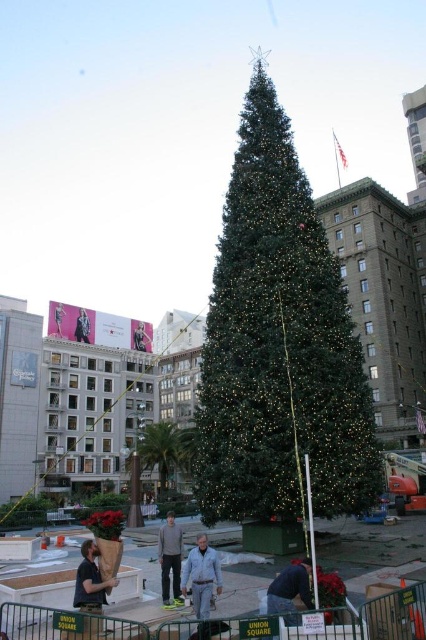
You are standing in front of the Christmas tree in Union Square and see a dark brown leather jacket at lower left. Where exactly is the dark brown leather jacket located in terms of coordinates?

The dark brown leather jacket at lower left is located at coordinates point [91,580].

You are a delivery drone with a package that needs to be delivered to a person standing at the base of the Christmas tree. The person is wearing the dark gray pants at center and the black leather jacket at upper left. Can you fly directly between these two items to reach the person?

The dark gray pants at center and the black leather jacket at upper left are 38.54 meters apart from each other. Since the distance is quite large, the drone can safely fly directly between them to reach the person at the base of the Christmas tree.